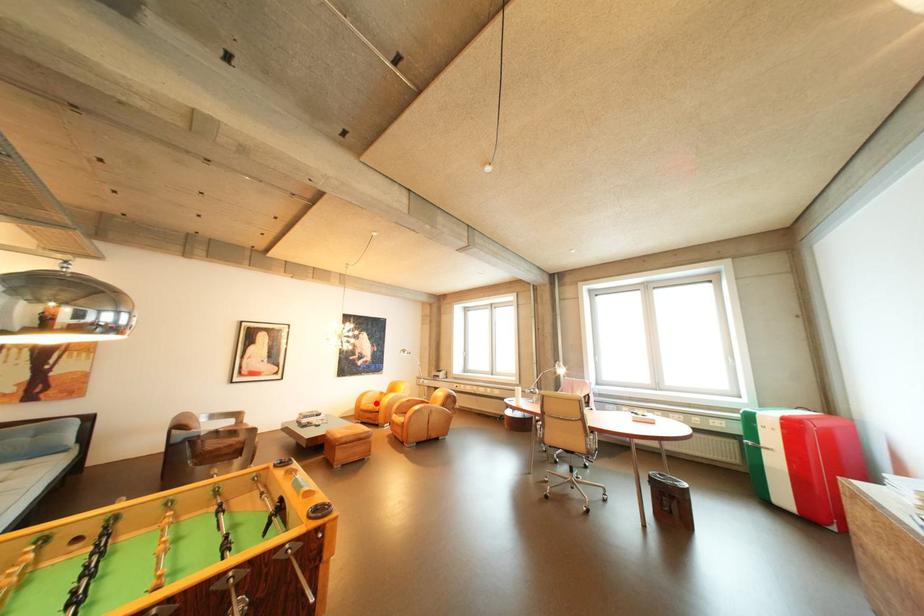
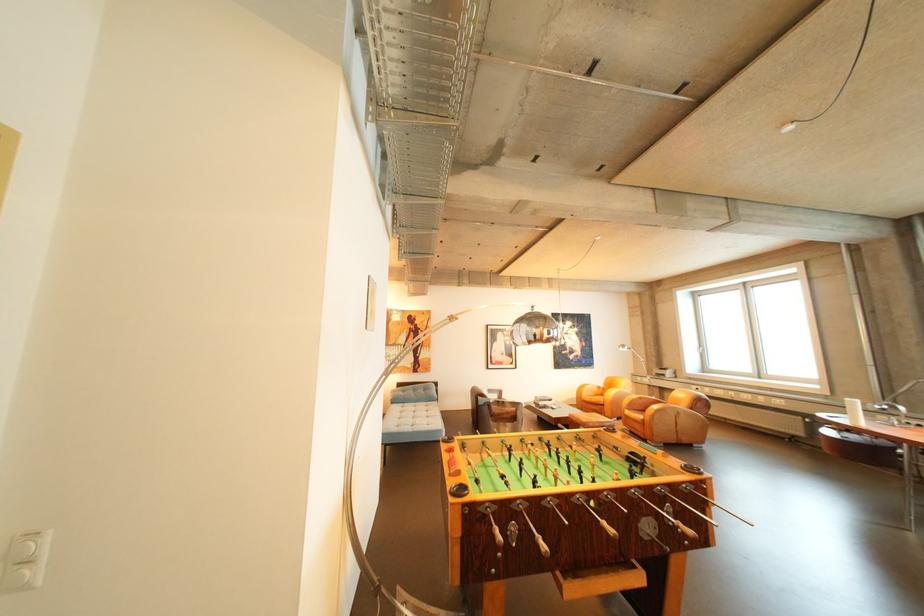
Question: I am providing you with two images of the same scene from different viewpoints. In image1, a red point is highlighted. Considering the same 3D point in image2, which of the following is correct?

Choices:
 (A) It is closer
 (B) It is farther

Answer: (A)